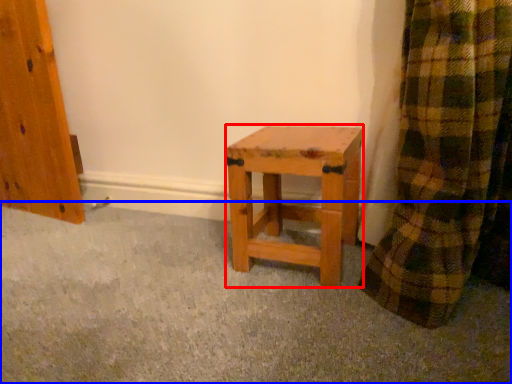
Question: Which object appears farthest to the camera in this image, stool (highlighted by a red box) or concrete (highlighted by a blue box)?

Choices:
 (A) stool
 (B) concrete

Answer: (A)